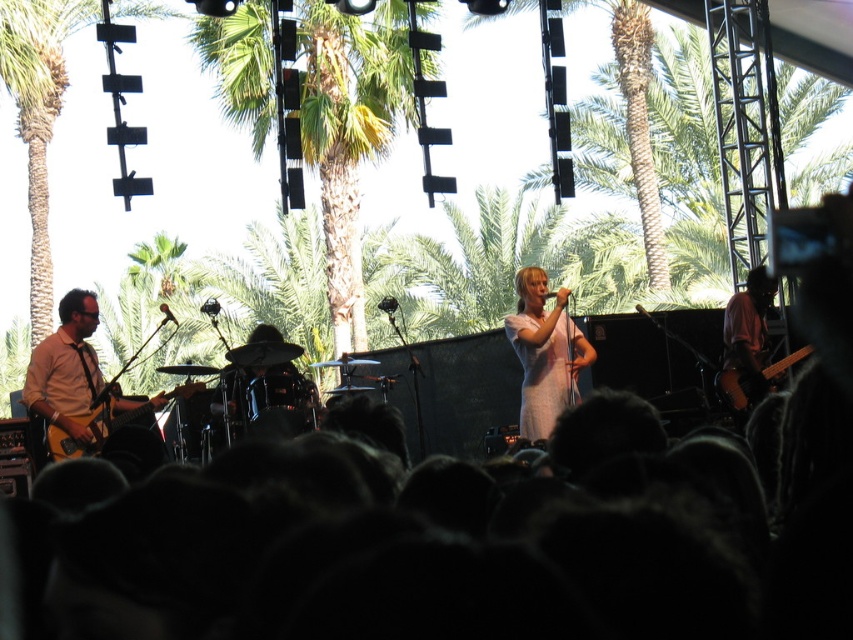
Question: Among these points, which one is nearest to the camera?

Choices:
 (A) (62, 424)
 (B) (544, 349)
 (C) (221, 24)

Answer: (A)

Question: Does black hair at lower center have a greater width compared to wooden electric guitar at right?

Choices:
 (A) no
 (B) yes

Answer: (B)

Question: Where is matte brown guitar at left located in relation to wooden electric guitar at right in the image?

Choices:
 (A) below
 (B) above

Answer: (B)

Question: Which of the following is the closest to the observer?

Choices:
 (A) wooden electric guitar at right
 (B) matte brown guitar at left
 (C) black hair at lower center

Answer: (C)

Question: Which object is the closest to the black hair at lower center?

Choices:
 (A) wooden electric guitar at right
 (B) matte brown guitar at left
 (C) green leafy palm tree at center

Answer: (B)

Question: Can you confirm if matte brown guitar at left is wider than white cotton dress at center?

Choices:
 (A) no
 (B) yes

Answer: (B)